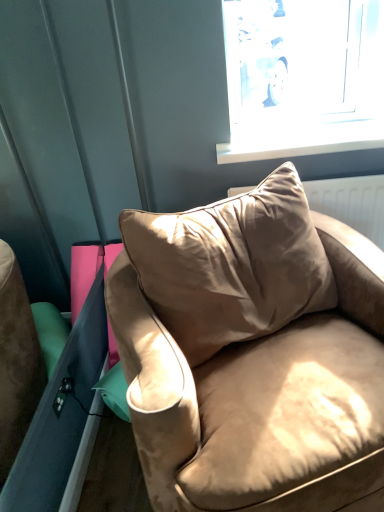
Describe the element at coordinates (251, 352) in the screenshot. I see `suede beige couch at center` at that location.

This screenshot has height=512, width=384. Identify the location of suede beige couch at center. [251, 352].

Identify the location of suede beige couch at center. (251, 352).